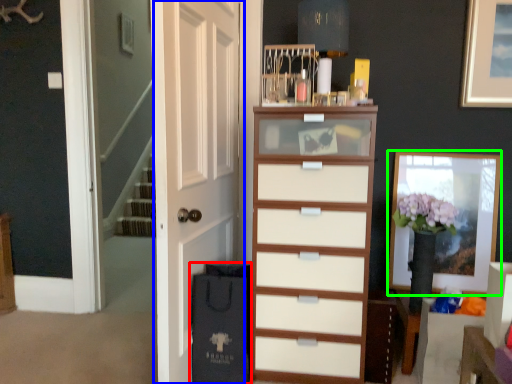
Question: Estimate the real-world distances between objects in this image. Which object is farther from shopping bag (highlighted by a red box), door (highlighted by a blue box) or picture frame (highlighted by a green box)?

Choices:
 (A) door
 (B) picture frame

Answer: (B)